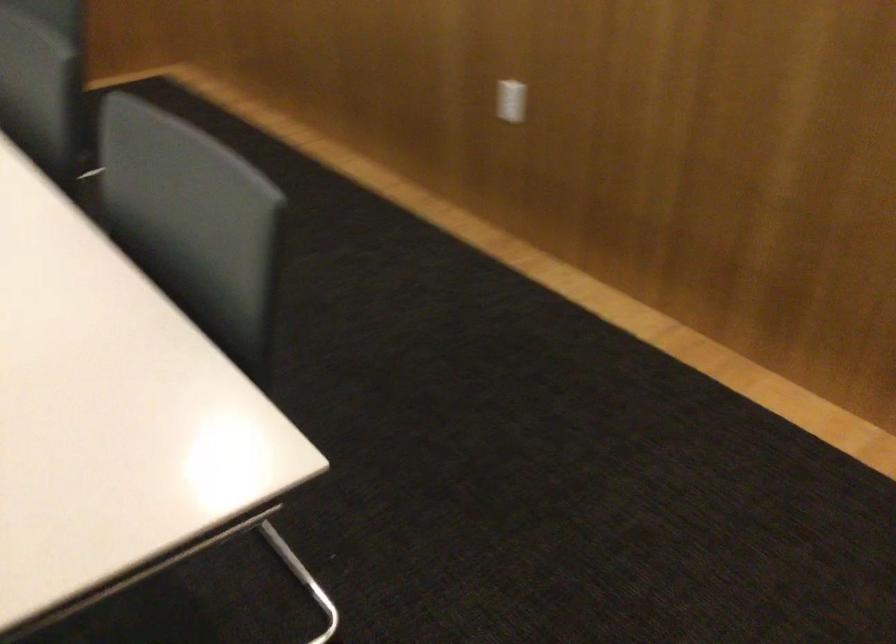
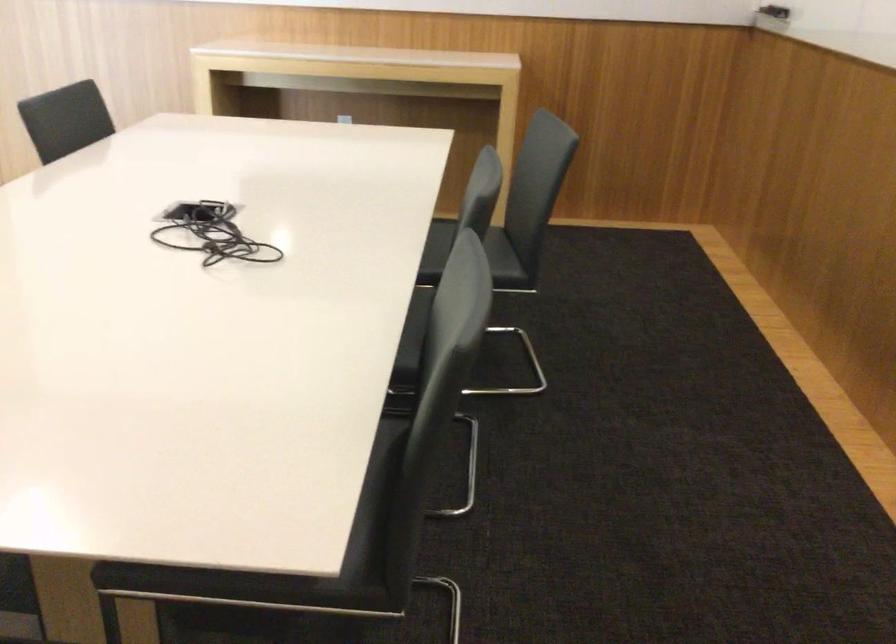
Question: The first image is from the beginning of the video and the second image is from the end. How did the camera likely rotate when shooting the video?

Choices:
 (A) Left
 (B) Right
 (C) Up
 (D) Down

Answer: (A)